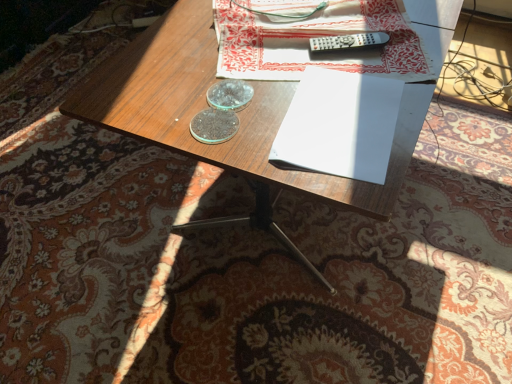
Identify the location of white paper at upper center. (318, 36).

Where is `black plastic remote at upper center`? black plastic remote at upper center is located at coordinates (348, 41).

Which object is positioned more to the left, black plastic remote at upper center or white paper at center?

Positioned to the left is white paper at center.

Is black plastic remote at upper center beside white paper at center?

No.

Is black plastic remote at upper center smaller than white paper at center?

Yes.

Can you tell me how much black plastic remote at upper center and white paper at center differ in facing direction?

There is a 67.2-degree angle between the facing directions of black plastic remote at upper center and white paper at center.

Which is in front, point (229, 7) or point (371, 97)?

The point (371, 97) is more forward.

Looking at this image, could you tell me if white paper at upper center is facing white paper at center?

Yes, white paper at upper center is aimed at white paper at center.

From a real-world perspective, which is physically below, white paper at upper center or white paper at center?

white paper at center is physically lower.

Is white paper at upper center wider or thinner than white paper at center?

Considering their sizes, white paper at upper center looks broader than white paper at center.

From a real-world perspective, relative to black plastic remote at upper center, is wooden desk at center vertically above or below?

wooden desk at center is below black plastic remote at upper center.

Is wooden desk at center next to black plastic remote at upper center?

wooden desk at center is not next to black plastic remote at upper center, and they're not touching.

How different are the orientations of wooden desk at center and black plastic remote at upper center in degrees?

28.4 degrees separate the facing orientations of wooden desk at center and black plastic remote at upper center.

Is wooden desk at center positioned behind black plastic remote at upper center?

No, it is in front of black plastic remote at upper center.

Are black plastic remote at upper center and wooden desk at center located far from each other?

No.

From a real-world perspective, does black plastic remote at upper center sit lower than wooden desk at center?

Actually, black plastic remote at upper center is physically above wooden desk at center in the real world.

Is black plastic remote at upper center completely or partially outside of wooden desk at center?

black plastic remote at upper center lies outside wooden desk at center's area.

Which object is closer to the camera taking this photo, black plastic remote at upper center or wooden desk at center?

wooden desk at center.

From a real-world perspective, which object rests below the other?

black plastic remote at upper center is physically lower.

In the scene shown: Which of these two, white paper at upper center or black plastic remote at upper center, is thinner?

black plastic remote at upper center.

Considering the positions of objects white paper at center and white paper at upper center in the image provided, who is more to the left, white paper at center or white paper at upper center?

white paper at upper center is more to the left.

From a real-world perspective, is white paper at center under white paper at upper center?

Yes, from a real-world perspective, white paper at center is below white paper at upper center.

Between point (350, 161) and point (403, 55), which one is positioned behind?

The point (403, 55) is farther from the camera.

From the image's perspective, is white paper at center on top of white paper at upper center?

No, from the image's perspective, white paper at center is not over white paper at upper center.

Can you confirm if wooden desk at center is thinner than white paper at center?

In fact, wooden desk at center might be wider than white paper at center.

Is wooden desk at center positioned before white paper at center?

Yes, wooden desk at center is closer to the viewer.

The height and width of the screenshot is (384, 512). I want to click on paperback book on the left of black plastic remote at upper center, so click(x=340, y=125).

The image size is (512, 384). In order to click on sheet above the white paper at center (from a real-world perspective) in this screenshot , I will do `click(318, 36)`.

Estimate the real-world distances between objects in this image. Which object is closer to black plastic remote at upper center, wooden desk at center or white paper at upper center?

white paper at upper center is closer to black plastic remote at upper center.

Estimate the real-world distances between objects in this image. Which object is further from white paper at center, white paper at upper center or wooden desk at center?

white paper at upper center.

Based on their spatial positions, is white paper at upper center or black plastic remote at upper center further from white paper at center?

Based on the image, black plastic remote at upper center appears to be further to white paper at center.

Based on their spatial positions, is black plastic remote at upper center or wooden desk at center further from white paper at center?

black plastic remote at upper center.

Considering their positions, is black plastic remote at upper center positioned further to white paper at upper center than white paper at center?

white paper at center lies further to white paper at upper center than the other object.

Considering their positions, is white paper at upper center positioned further to black plastic remote at upper center than white paper at center?

Based on the image, white paper at center appears to be further to black plastic remote at upper center.

Looking at the image, which one is located further to white paper at center, black plastic remote at upper center or white paper at upper center?

black plastic remote at upper center lies further to white paper at center than the other object.

From the image, which object appears to be farther from white paper at upper center, white paper at center or black plastic remote at upper center?

white paper at center.

The width and height of the screenshot is (512, 384). Find the location of `remote control that lies between white paper at upper center and white paper at center from top to bottom`. remote control that lies between white paper at upper center and white paper at center from top to bottom is located at coordinates (348, 41).

Identify the location of paperback book located between wooden desk at center and black plastic remote at upper center in the depth direction. (340, 125).

Find the location of a particular element. desk between white paper at upper center and white paper at center in the vertical direction is located at coordinates (239, 113).

This screenshot has width=512, height=384. Identify the location of sheet between wooden desk at center and black plastic remote at upper center from front to back. (318, 36).